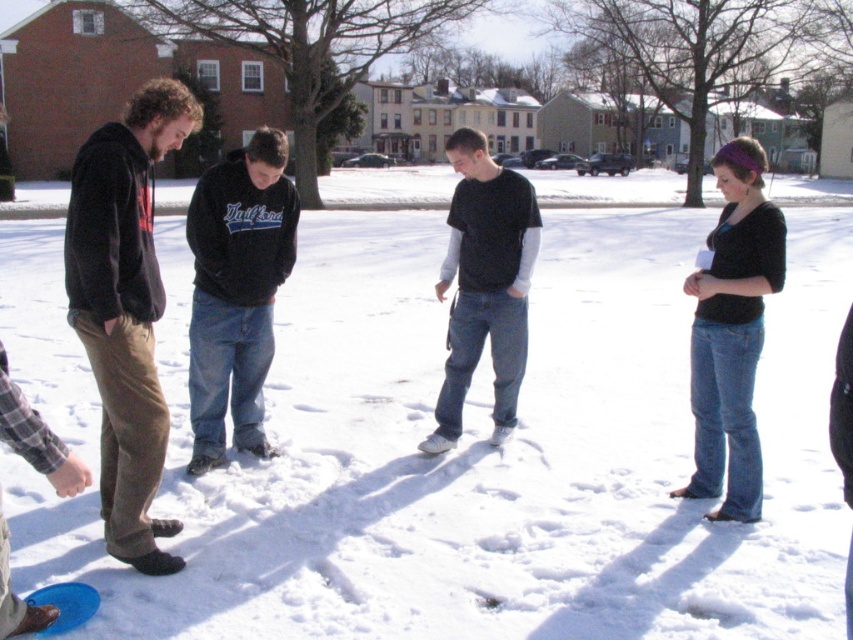
Question: Is dark brown corduroy pants at left behind black cotton shirt at center?

Choices:
 (A) no
 (B) yes

Answer: (A)

Question: Is dark brown corduroy pants at left positioned behind black cotton hoodie at center?

Choices:
 (A) no
 (B) yes

Answer: (A)

Question: Is dark brown corduroy pants at left to the left of black cotton shirt at center from the viewer's perspective?

Choices:
 (A) yes
 (B) no

Answer: (A)

Question: Which object appears closest to the camera in this image?

Choices:
 (A) black cotton hoodie at center
 (B) dark brown corduroy pants at left
 (C) black cotton shirt at center

Answer: (B)

Question: Considering the real-world distances, which object is closest to the denim jeans at right?

Choices:
 (A) black cotton shirt at center
 (B) dark brown corduroy pants at left
 (C) black cotton hoodie at center

Answer: (A)

Question: Considering the real-world distances, which object is closest to the denim jeans at right?

Choices:
 (A) dark brown corduroy pants at left
 (B) black cotton shirt at center
 (C) black cotton hoodie at center

Answer: (B)